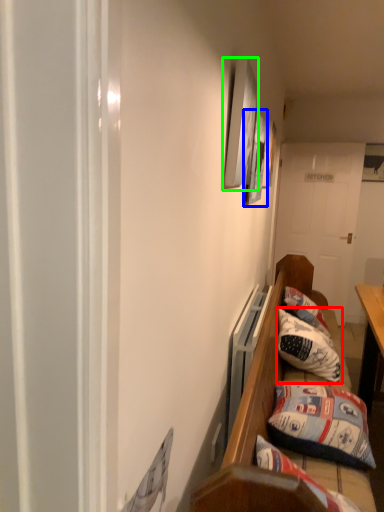
Question: Considering the real-world distances, which object is closest to pillow (highlighted by a red box)? picture frame (highlighted by a blue box) or picture frame (highlighted by a green box).

Choices:
 (A) picture frame
 (B) picture frame

Answer: (A)